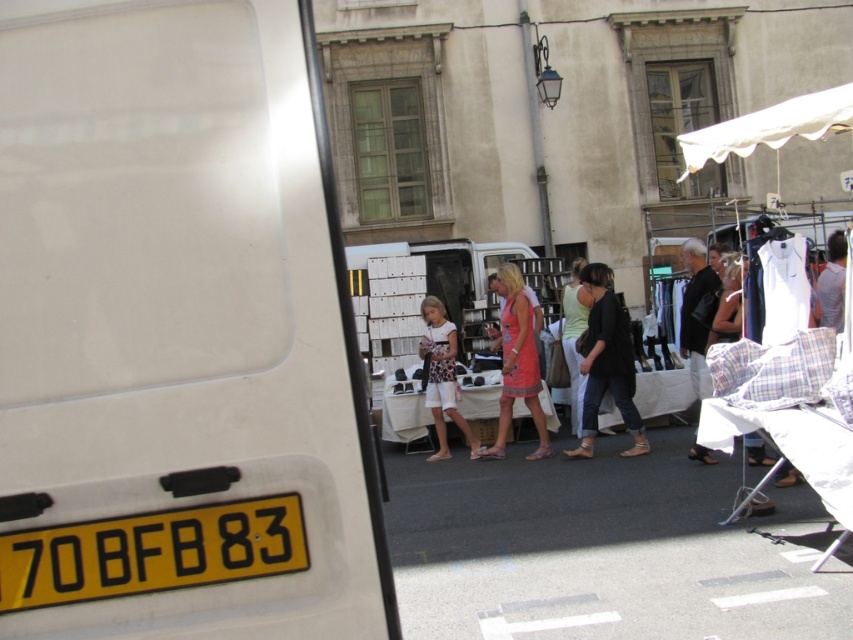
Does white matte van at left have a lesser height compared to yellow plastic license plate at lower left?

Incorrect, white matte van at left's height does not fall short of yellow plastic license plate at lower left's.

Is point (33, 365) positioned in front of point (227, 522)?

Yes, point (33, 365) is in front of point (227, 522).

At what (x,y) coordinates should I click in order to perform the action: click on white matte van at left. Please return your answer as a coordinate pair (x, y). This screenshot has width=853, height=640. Looking at the image, I should click on (177, 332).

Who is lower down, white matte van at left or black leather jacket at center?

black leather jacket at center is below.

Which is behind, point (67, 99) or point (633, 404)?

Positioned behind is point (633, 404).

Locate an element on the screen. Image resolution: width=853 pixels, height=640 pixels. white matte van at left is located at coordinates (177, 332).

Can you confirm if white cotton shorts at center is smaller than gray cotton shirt at right?

Correct, white cotton shorts at center occupies less space than gray cotton shirt at right.

I want to click on white cotton shorts at center, so click(442, 376).

Where is `white cotton shorts at center`? The width and height of the screenshot is (853, 640). white cotton shorts at center is located at coordinates (442, 376).